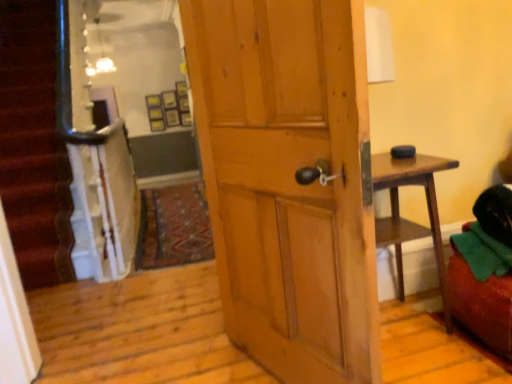
In the scene shown: Measure the distance between velvet green bean bag chair at right and camera.

velvet green bean bag chair at right is 1.50 meters away from camera.

Describe the element at coordinates (485, 271) in the screenshot. I see `velvet green bean bag chair at right` at that location.

Where is `velvet green bean bag chair at right`? velvet green bean bag chair at right is located at coordinates (485, 271).

What do you see at coordinates (289, 181) in the screenshot? I see `wooden door at center` at bounding box center [289, 181].

You are a GUI agent. You are given a task and a screenshot of the screen. Output one action in this format:
    pyautogui.click(x=<x>, y=<y>)
    Task: Click on the wooden door at center
    
    Given the screenshot: What is the action you would take?
    pyautogui.click(x=289, y=181)

Measure the distance between wooden door at center and camera.

A distance of 36.95 inches exists between wooden door at center and camera.

This screenshot has width=512, height=384. Find the location of `velvet green bean bag chair at right`. velvet green bean bag chair at right is located at coordinates (485, 271).

Is velvet green bean bag chair at right to the left of wooden door at center from the viewer's perspective?

No.

Considering their positions, is velvet green bean bag chair at right located in front of or behind wooden door at center?

velvet green bean bag chair at right is behind wooden door at center.

Which point is more distant from viewer, (486,218) or (271,126)?

The point (486,218) is more distant.

From the image's perspective, who appears lower, velvet green bean bag chair at right or wooden door at center?

velvet green bean bag chair at right appears lower in the image.

From a real-world perspective, is velvet green bean bag chair at right beneath wooden door at center?

Indeed, from a real-world perspective, velvet green bean bag chair at right is positioned beneath wooden door at center.

Looking at this image, does velvet green bean bag chair at right have a greater width compared to wooden door at center?

Yes.

Does velvet green bean bag chair at right have a greater height compared to wooden door at center?

No.

Considering the sizes of objects velvet green bean bag chair at right and wooden door at center in the image provided, who is smaller, velvet green bean bag chair at right or wooden door at center?

With smaller size is velvet green bean bag chair at right.

Would you say wooden door at center is part of velvet green bean bag chair at right's contents?

No, wooden door at center is not a part of velvet green bean bag chair at right.

Is the surface of velvet green bean bag chair at right in direct contact with wooden door at center?

There is a gap between velvet green bean bag chair at right and wooden door at center.

Is velvet green bean bag chair at right turned away from wooden door at center?

That's not correct — velvet green bean bag chair at right is not looking away from wooden door at center.

Based on the photo, how much distance is there between velvet green bean bag chair at right and wooden door at center?

36.19 inches.

This screenshot has width=512, height=384. In order to click on bean bag chair lying below the wooden door at center (from the image's perspective) in this screenshot , I will do `click(485, 271)`.

Consider the image. Is wooden door at center to the left or to the right of velvet green bean bag chair at right in the image?

Based on their positions, wooden door at center is located to the left of velvet green bean bag chair at right.

Between wooden door at center and velvet green bean bag chair at right, which one is positioned in front?

wooden door at center is more forward.

Is point (331, 343) behind point (509, 188)?

No, it is in front of (509, 188).

From the image's perspective, between wooden door at center and velvet green bean bag chair at right, who is located below?

From the image's view, velvet green bean bag chair at right is below.

From a real-world perspective, which is physically above, wooden door at center or velvet green bean bag chair at right?

wooden door at center, from a real-world perspective.

Can you confirm if wooden door at center is wider than velvet green bean bag chair at right?

No.

Does wooden door at center have a greater height compared to velvet green bean bag chair at right?

Indeed, wooden door at center has a greater height compared to velvet green bean bag chair at right.

Between wooden door at center and velvet green bean bag chair at right, which one has smaller size?

velvet green bean bag chair at right.

Is wooden door at center inside or outside of velvet green bean bag chair at right?

wooden door at center is not inside velvet green bean bag chair at right, it's outside.

Are wooden door at center and velvet green bean bag chair at right far apart?

Result: wooden door at center is near velvet green bean bag chair at right, not far away.

Could you tell me if wooden door at center is turned towards velvet green bean bag chair at right?

No, wooden door at center is not facing towards velvet green bean bag chair at right.

The width and height of the screenshot is (512, 384). In order to click on door on the left of velvet green bean bag chair at right in this screenshot , I will do pyautogui.click(x=289, y=181).

I want to click on bean bag chair that appears below the wooden door at center (from the image's perspective), so click(485, 271).

I want to click on bean bag chair behind the wooden door at center, so click(x=485, y=271).